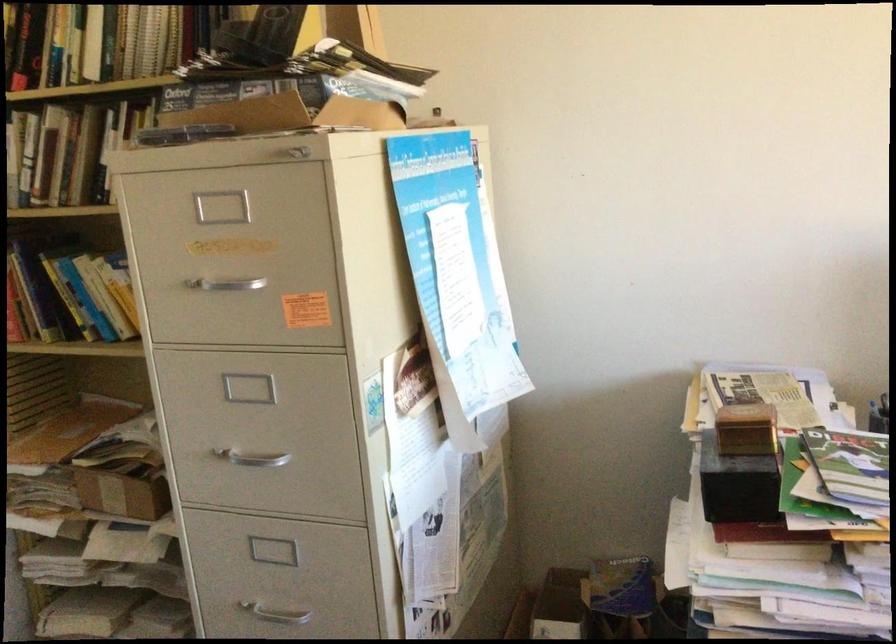
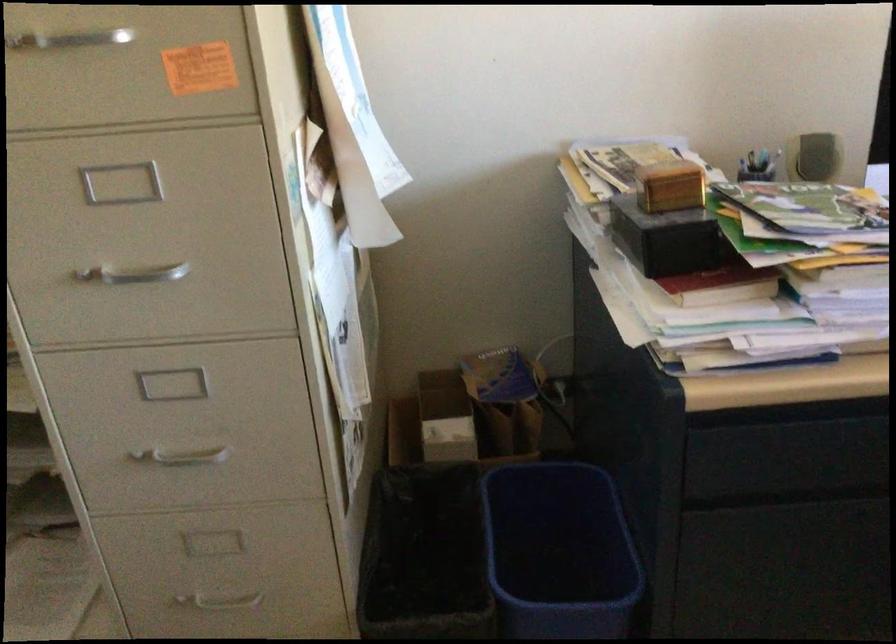
Locate, in the second image, the point that corresponds to (x=225, y=290) in the first image.

(67, 40)